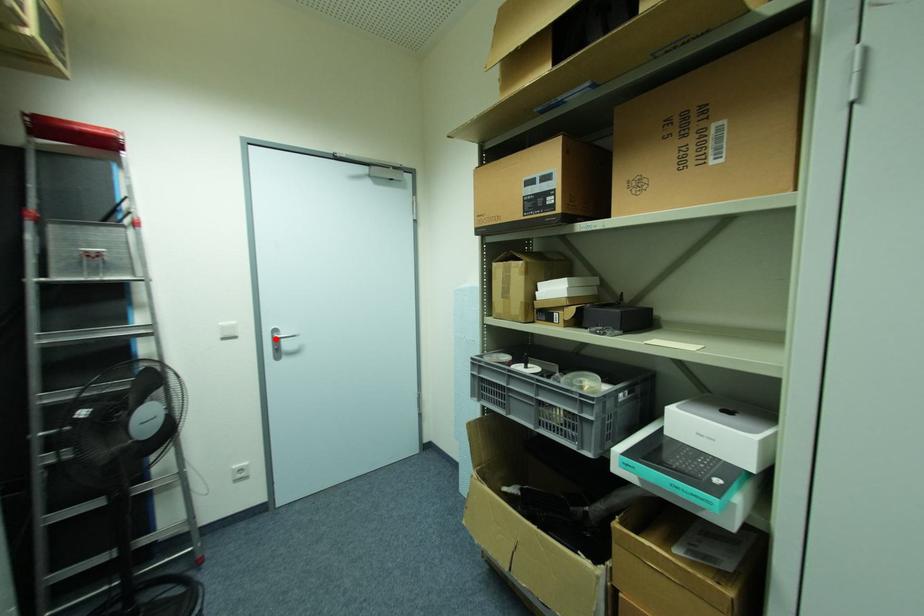
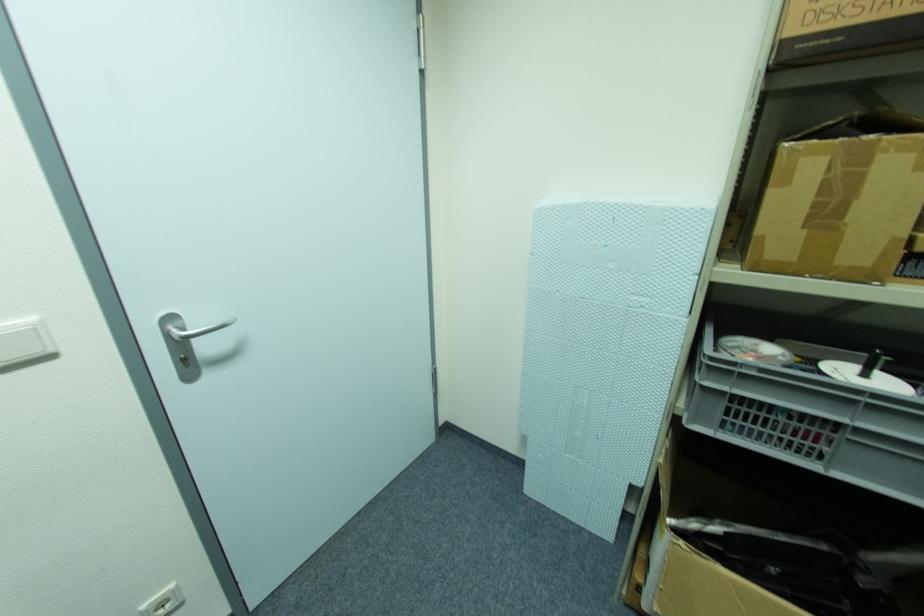
Find the pixel in the second image that matches the highlighted location in the first image.

(177, 339)